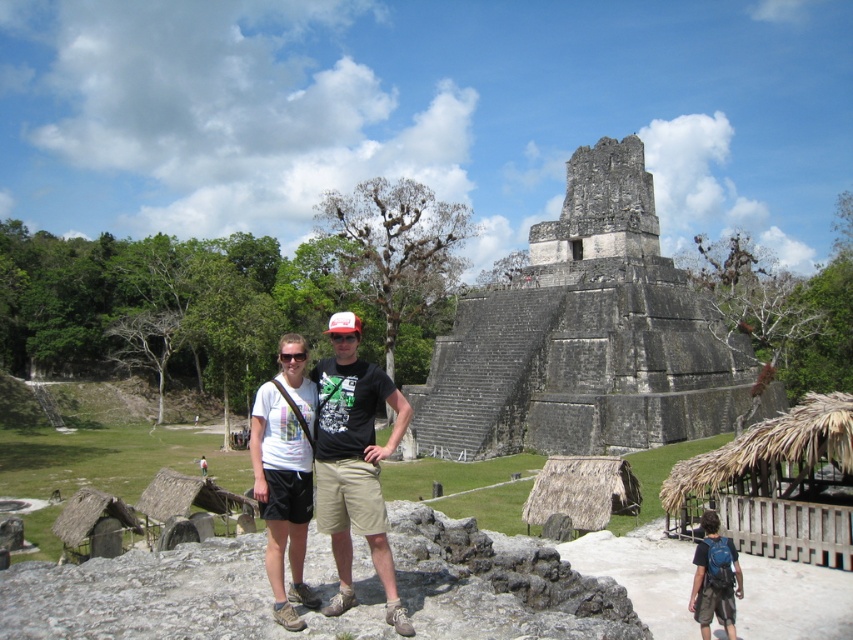
Question: Does gray stone ruins at center appear on the left side of white cotton shirt at center?

Choices:
 (A) no
 (B) yes

Answer: (A)

Question: Which object is positioned farthest from the white matte t-shirt at center?

Choices:
 (A) gray stone ruins at center
 (B) white cotton shirt at center

Answer: (A)

Question: Can you confirm if gray stone ruins at center is positioned above white cotton shirt at center?

Choices:
 (A) yes
 (B) no

Answer: (A)

Question: Is gray stone ruins at center to the left of white matte t-shirt at center from the viewer's perspective?

Choices:
 (A) yes
 (B) no

Answer: (B)

Question: Which object is positioned closest to the white cotton shirt at center?

Choices:
 (A) gray stone ruins at center
 (B) white matte t-shirt at center

Answer: (B)

Question: Among these points, which one is farthest from the camera?

Choices:
 (A) (541, 406)
 (B) (283, 483)
 (C) (364, 365)

Answer: (A)